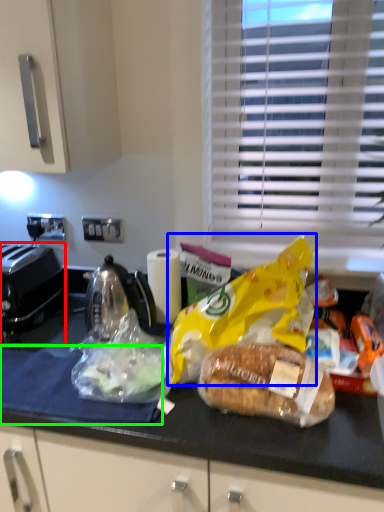
Question: Estimate the real-world distances between objects in this image. Which object is closer to toaster (highlighted by a red box), plastic bag (highlighted by a blue box) or cloth (highlighted by a green box)?

Choices:
 (A) plastic bag
 (B) cloth

Answer: (B)